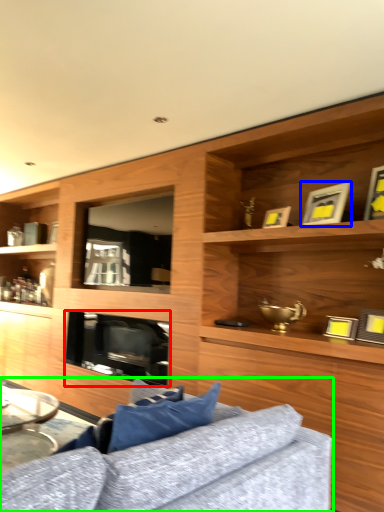
Question: Estimate the real-world distances between objects in this image. Which object is farther from fireplace (highlighted by a red box), picture frame (highlighted by a blue box) or studio couch (highlighted by a green box)?

Choices:
 (A) picture frame
 (B) studio couch

Answer: (B)